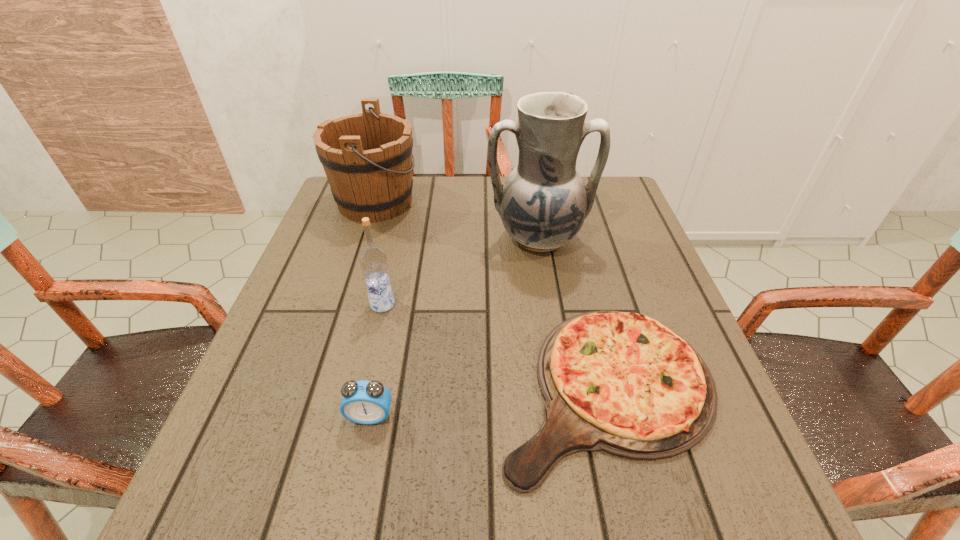
The width and height of the screenshot is (960, 540). What are the coordinates of `vacant area between the third farthest object and the pizza` in the screenshot? It's located at (494, 347).

The image size is (960, 540). I want to click on free space between the wine bucket and the shortest object, so click(x=491, y=295).

Locate an element on the screen. The image size is (960, 540). unoccupied position between the pizza and the second shortest object is located at coordinates (489, 402).

This screenshot has width=960, height=540. Find the location of `vacant point located between the alarm clock and the pizza`. vacant point located between the alarm clock and the pizza is located at coordinates [x=489, y=402].

Point out which object is positioned as the third nearest to the wine bucket. Please provide its 2D coordinates. Your answer should be formatted as a tuple, i.e. [(x, y)], where the tuple contains the x and y coordinates of a point satisfying the conditions above.

[(623, 383)]

Identify the location of object identified as the third closest to the wine bucket. click(x=623, y=383).

This screenshot has width=960, height=540. I want to click on vacant position in the image that satisfies the following two spatial constraints: 1. on the side of the wine bucket with the handle for carrying; 2. on the back side of the vodka, so [343, 304].

Find the location of a particular element. The width and height of the screenshot is (960, 540). free point that satisfies the following two spatial constraints: 1. on the side of the third nearest object with the handle for carrying; 2. on the left side of the wine bucket is located at coordinates (343, 304).

The width and height of the screenshot is (960, 540). Find the location of `vacant area in the image that satisfies the following two spatial constraints: 1. on the side of the shortest object with the handle for carrying; 2. on the right side of the wine bucket`. vacant area in the image that satisfies the following two spatial constraints: 1. on the side of the shortest object with the handle for carrying; 2. on the right side of the wine bucket is located at coordinates (315, 389).